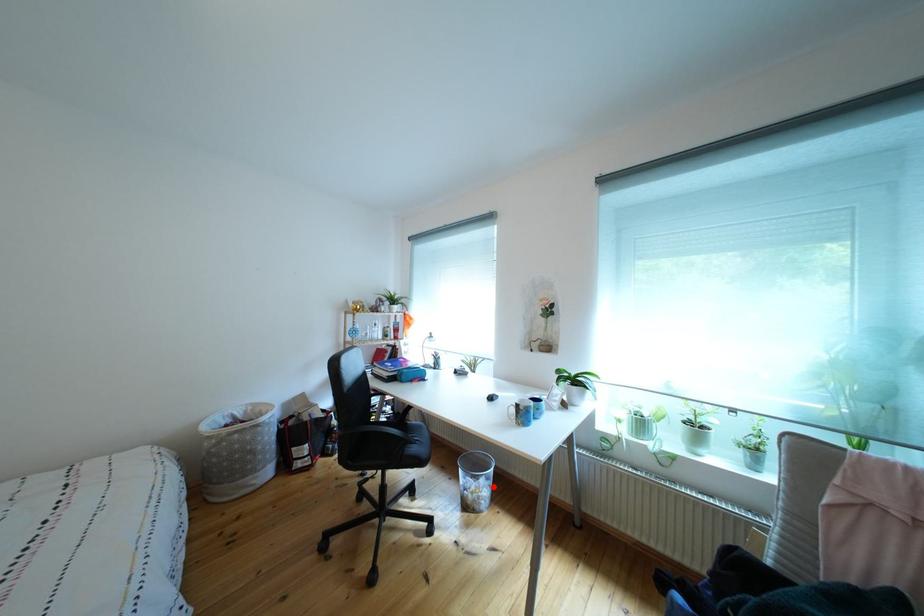
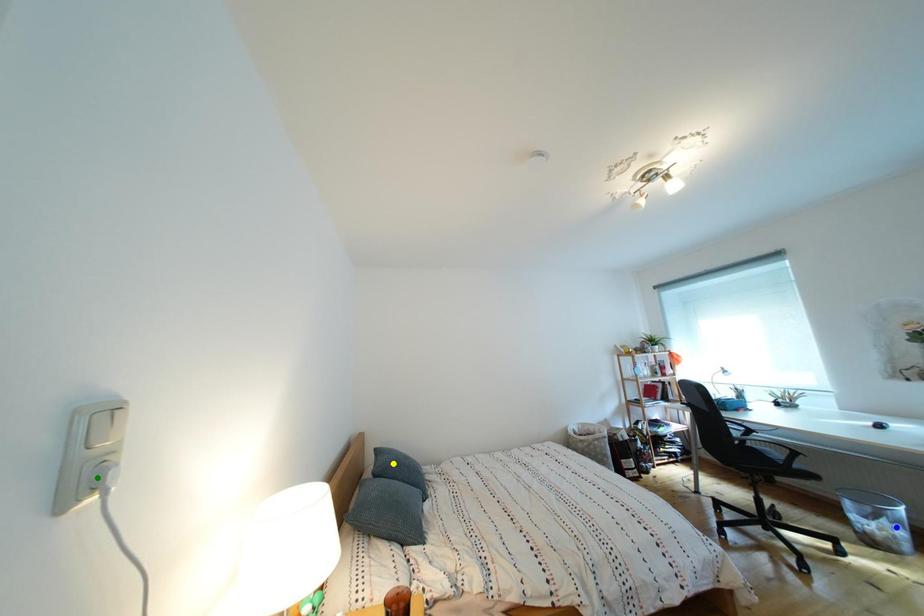
Question: I am providing you with two images of the same scene from different viewpoints. A red point is marked on the first image. You are given multiple points on the second image. Can you choose the point in image 2 that corresponds to the point in image 1?

Choices:
 (A) yellow point
 (B) green point
 (C) blue point

Answer: (C)